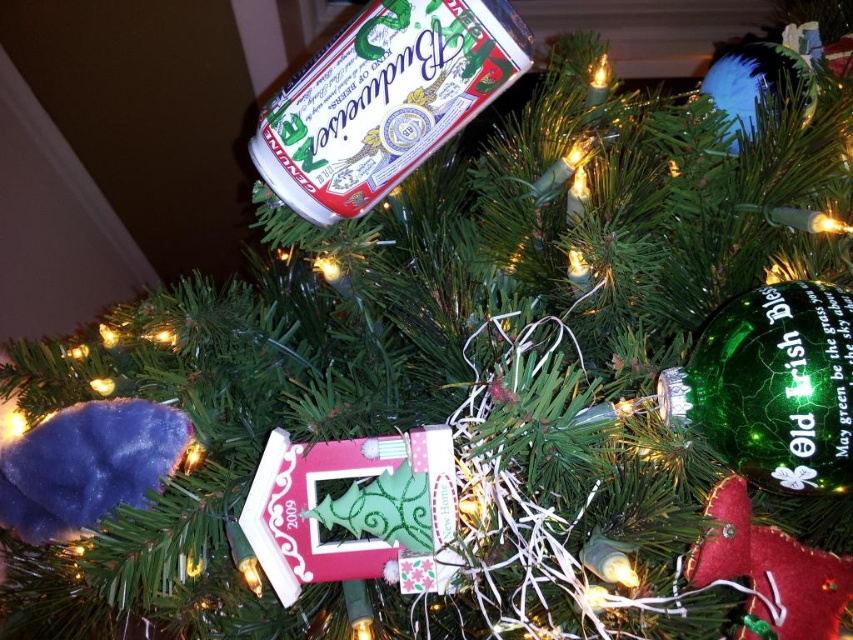
Question: Which of the following is the farthest from the observer?

Choices:
 (A) (328, 218)
 (B) (787, 406)

Answer: (A)

Question: Is metallic silver can at upper center above green glass ornament at upper right?

Choices:
 (A) yes
 (B) no

Answer: (A)

Question: Is metallic silver can at upper center closer to camera compared to green glass ornament at upper right?

Choices:
 (A) no
 (B) yes

Answer: (A)

Question: Considering the relative positions of metallic silver can at upper center and green glass ornament at upper right in the image provided, where is metallic silver can at upper center located with respect to green glass ornament at upper right?

Choices:
 (A) right
 (B) left

Answer: (B)

Question: Which point appears closest to the camera in this image?

Choices:
 (A) (465, 51)
 (B) (799, 410)

Answer: (B)